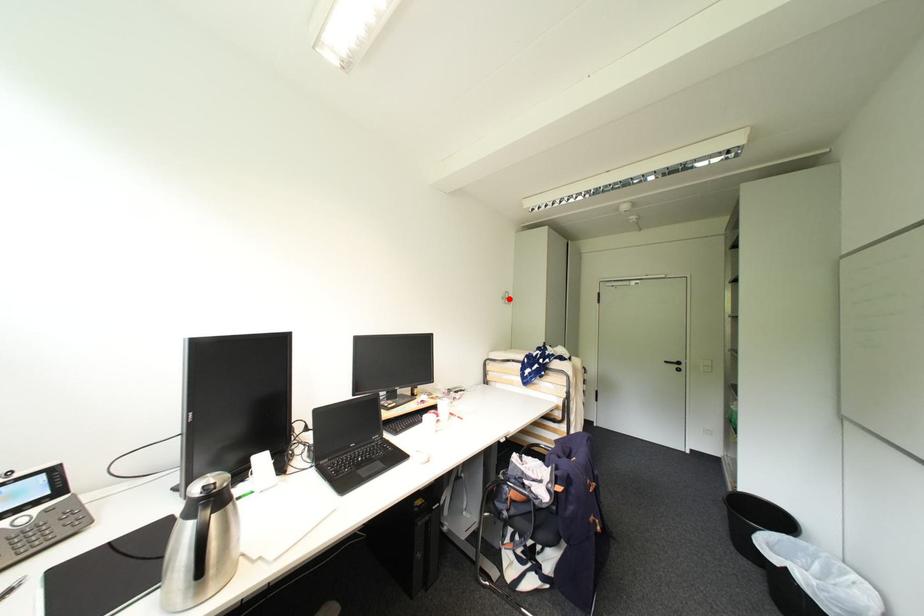
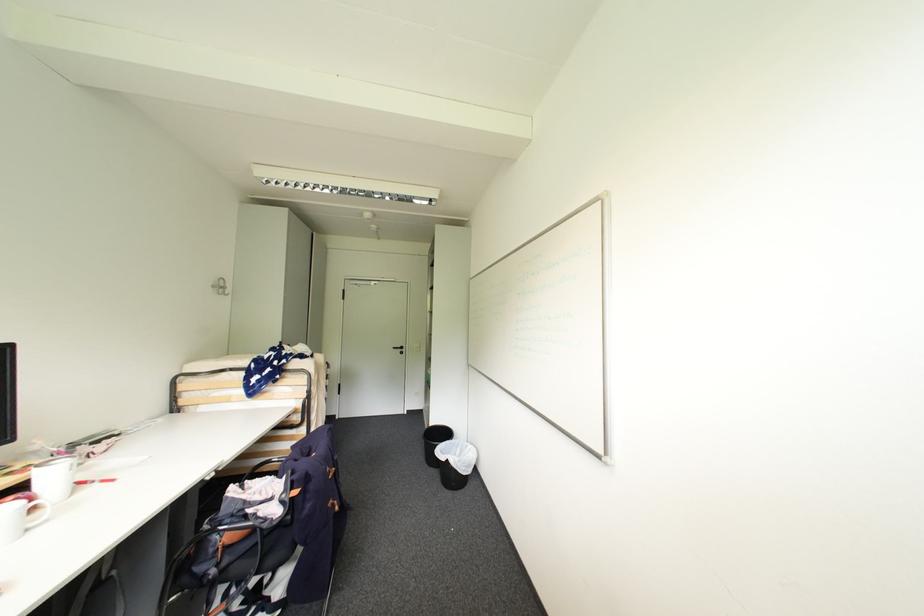
Where in the second image is the point corresponding to the highlighted location from the first image?

(220, 286)